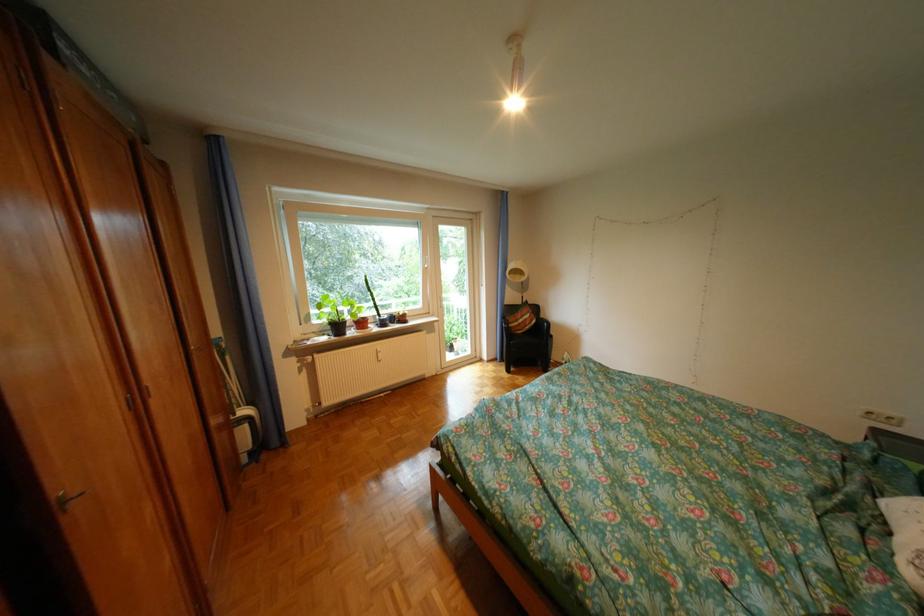
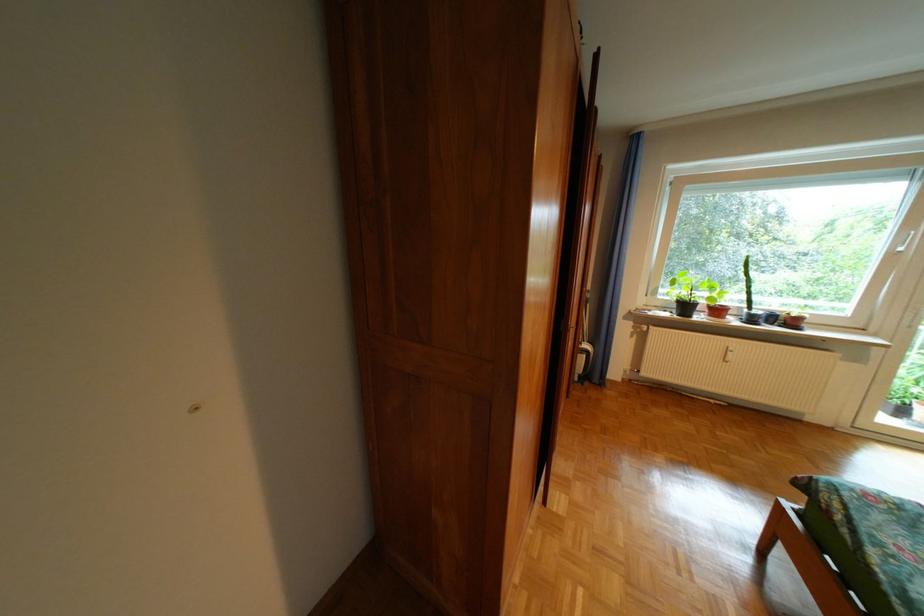
Locate, in the second image, the point that corresponds to (338,339) in the first image.

(679, 315)